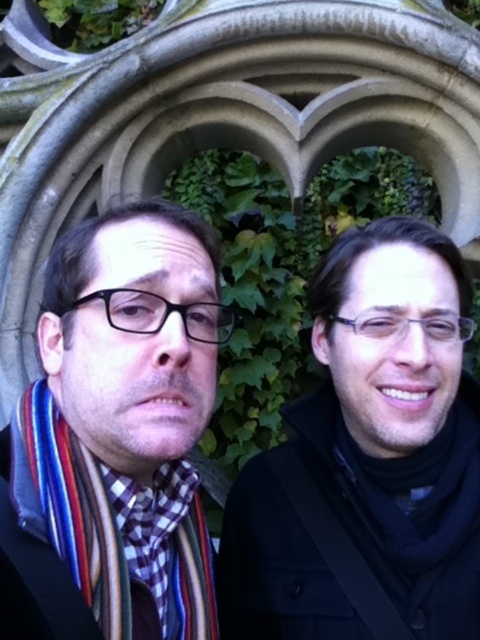
Question: Does black matte jacket at right have a smaller size compared to multicolored scarf at left?

Choices:
 (A) no
 (B) yes

Answer: (A)

Question: Among these objects, which one is farthest from the camera?

Choices:
 (A) black matte jacket at right
 (B) multicolored scarf at left

Answer: (A)

Question: Where is black matte jacket at right located in relation to multicolored scarf at left in the image?

Choices:
 (A) right
 (B) left

Answer: (A)

Question: Is black matte jacket at right thinner than multicolored scarf at left?

Choices:
 (A) no
 (B) yes

Answer: (A)